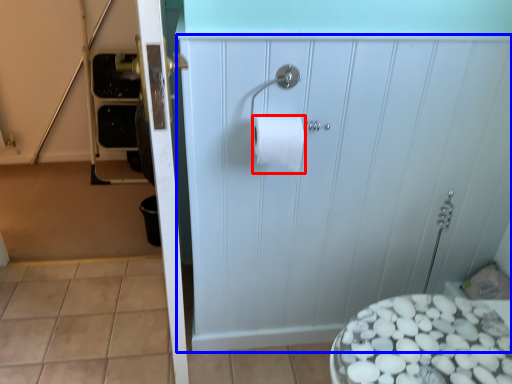
Question: Which point is further to the camera, toilet paper (highlighted by a red box) or screen door (highlighted by a blue box)?

Choices:
 (A) toilet paper
 (B) screen door

Answer: (A)